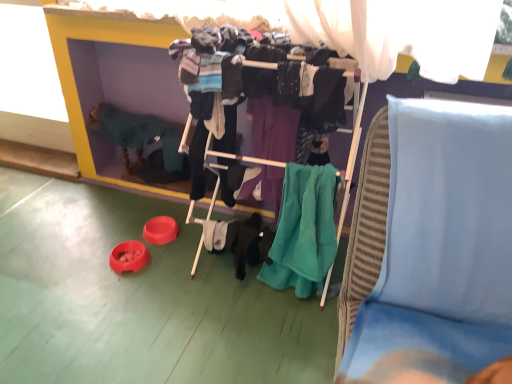
This screenshot has width=512, height=384. Find the location of `vacant space situated on the left part of teal soft towel at center`. vacant space situated on the left part of teal soft towel at center is located at coordinates (233, 324).